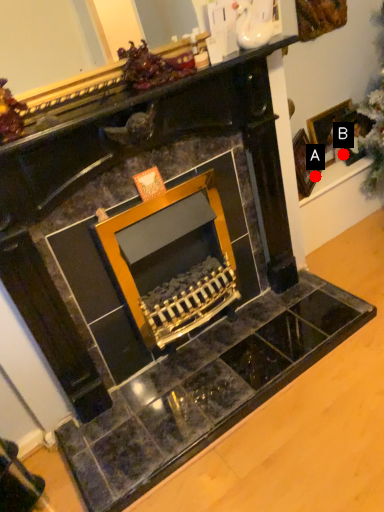
Question: Two points are circled on the image, labeled by A and B beside each circle. Which point is closer to the camera?

Choices:
 (A) A is closer
 (B) B is closer

Answer: (A)